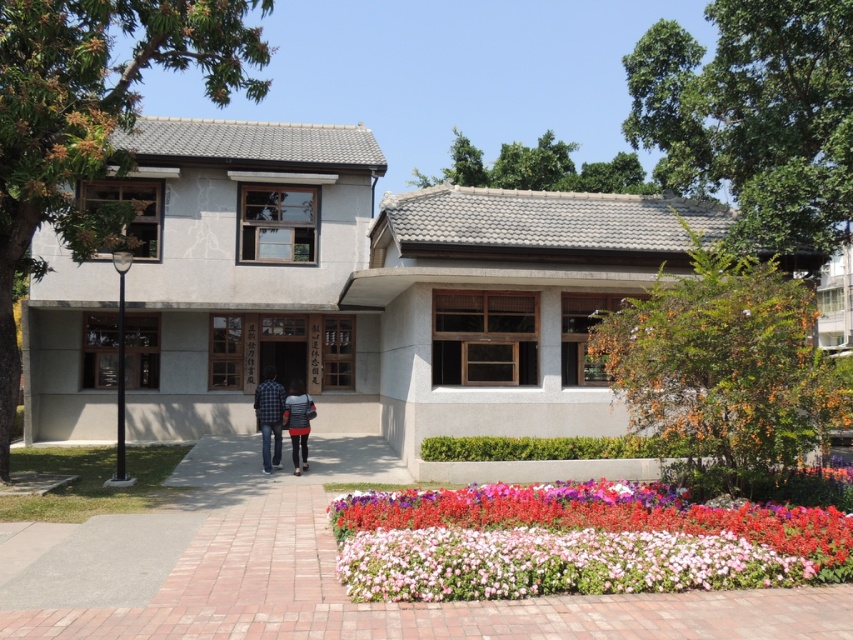
Measure the distance from matte concrete building at center to plaid shirt at center.

A distance of 16.97 feet exists between matte concrete building at center and plaid shirt at center.

Where is `matte concrete building at center`? This screenshot has width=853, height=640. matte concrete building at center is located at coordinates 370,285.

In order to click on matte concrete building at center in this screenshot , I will do `click(370, 285)`.

In the scene shown: Between multicolored floral carpet at lower center and striped fabric shirt at center, which one has less height?

multicolored floral carpet at lower center is shorter.

Is multicolored floral carpet at lower center shorter than striped fabric shirt at center?

Yes, multicolored floral carpet at lower center is shorter than striped fabric shirt at center.

Who is more distant from viewer, (485, 541) or (299, 433)?

The point (299, 433) is behind.

Where is `multicolored floral carpet at lower center`? Image resolution: width=853 pixels, height=640 pixels. multicolored floral carpet at lower center is located at coordinates (575, 541).

Does matte concrete building at center have a greater height compared to multicolored floral carpet at lower center?

Yes.

Is matte concrete building at center in front of multicolored floral carpet at lower center?

No, it is not.

The width and height of the screenshot is (853, 640). Find the location of `matte concrete building at center`. matte concrete building at center is located at coordinates (370, 285).